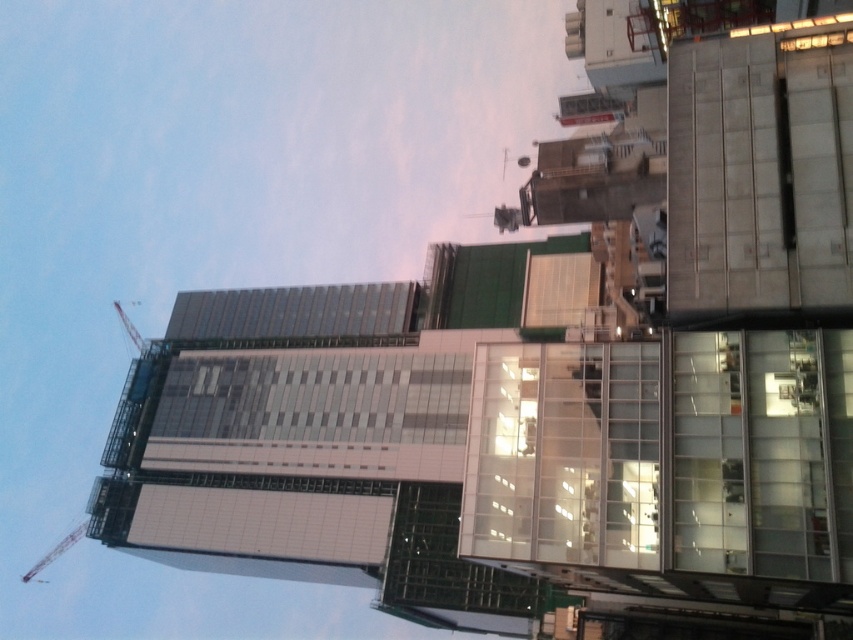
You are a construction worker who needs to move a heavy beam from the metallic red crane at left to the metallic construction crane at upper left. The beam is 60 meters long. Can you safely transport it without it touching the ground? Explain your reasoning.

The distance between the metallic red crane at left and the metallic construction crane at upper left is 57.81 meters. Since the beam is 60 meters long, it is longer than the distance between the two cranes. Therefore, you cannot safely transport the beam without it touching the ground because the beam would sag in the middle due to its length exceeding the span between the cranes.

You are a construction worker standing at the point indicated by point (56,550). You need to move towards the metallic red crane at left. Is the metallic red crane at left located to your left or right side?

The metallic red crane at left is located to your left side as you are facing the direction from point (56,550).

You are standing in front of the modern urban landscape and want to determine which of the two points, point [38,561] or point [131,336], is closer to you. Which point is closer?

Point [38,561] is closer to you because it is further to the viewer than point [131,336].